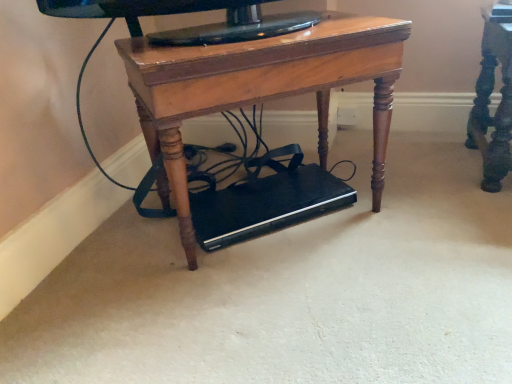
Identify the location of vacant area that lies to the right of wooden table at center. (421, 206).